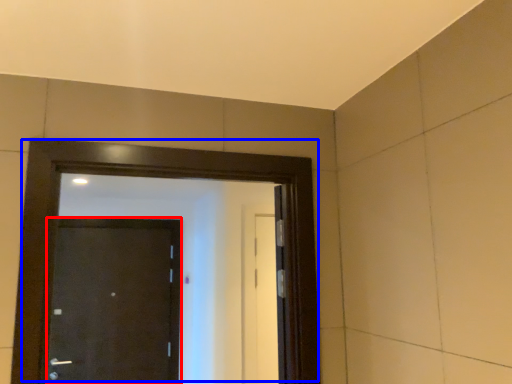
Question: Which of the following is the closest to the observer, door (highlighted by a red box) or door (highlighted by a blue box)?

Choices:
 (A) door
 (B) door

Answer: (B)